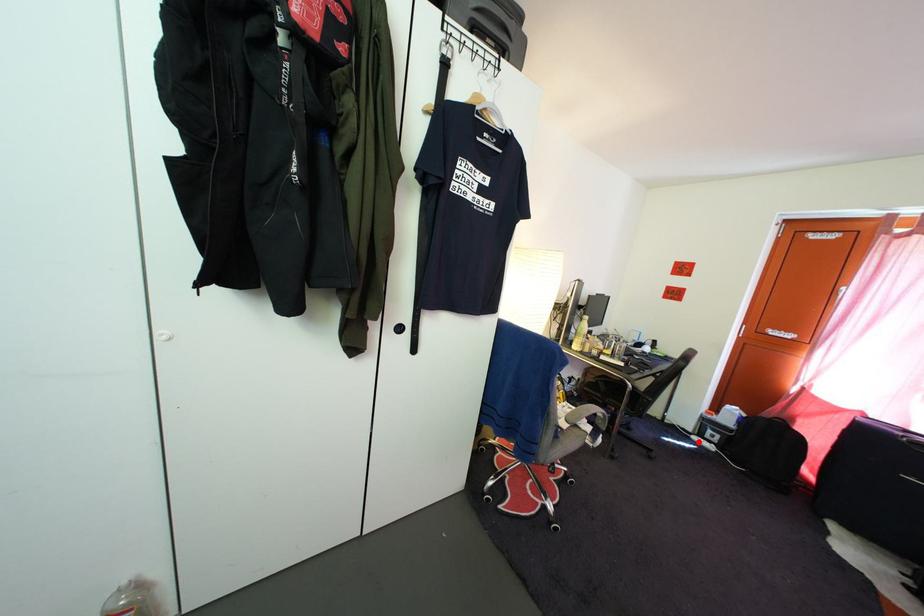
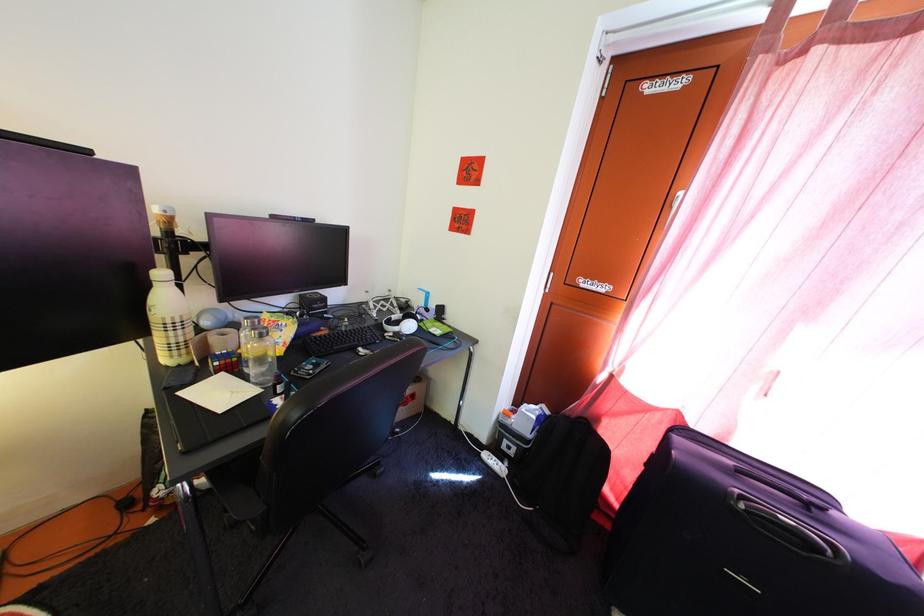
Question: I am providing you with two images of the same scene from different viewpoints. In image1, a red point is highlighted. Considering the same 3D point in image2, which of the following is correct?

Choices:
 (A) It is closer
 (B) It is farther

Answer: (B)